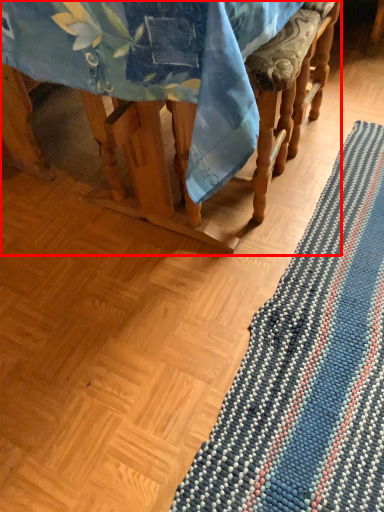
Question: From the image's perspective, where is furniture (annotated by the red box) located in relation to mat in the image?

Choices:
 (A) above
 (B) below

Answer: (A)